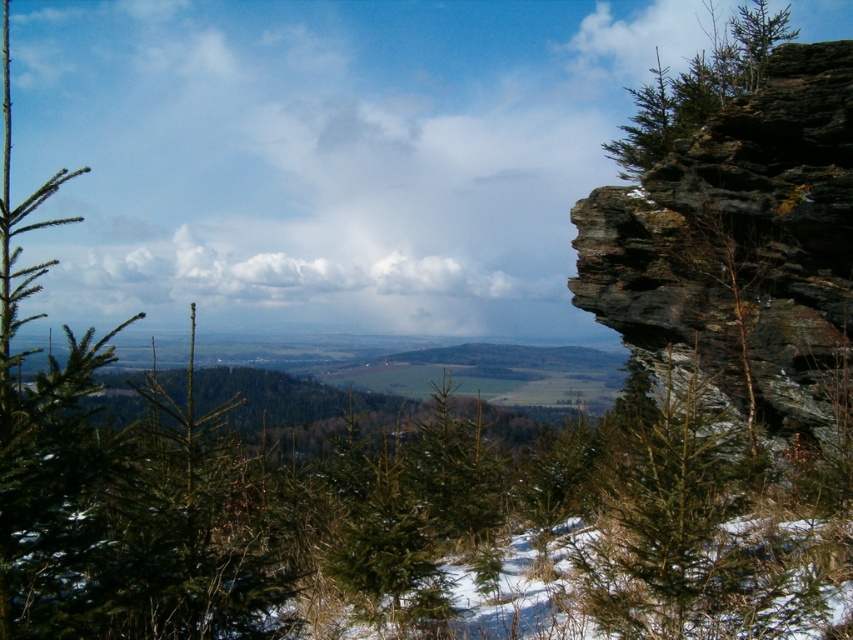
Which is in front, point (637, 540) or point (671, 88)?

Positioned in front is point (637, 540).

Measure the distance from green matte tree at right to green matte tree at upper right.

green matte tree at right and green matte tree at upper right are 50.40 meters apart.

Does point (677, 392) lie in front of point (724, 60)?

That is True.

Locate an element on the screen. Image resolution: width=853 pixels, height=640 pixels. green matte tree at right is located at coordinates (672, 516).